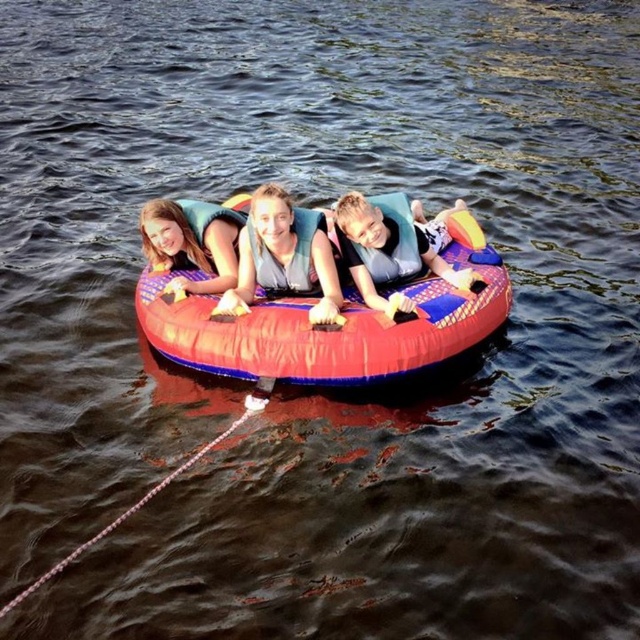
You are a safety inspector checking the inflatable tube setup. You see the rubberized red tube at center and the matte gray life vest at center. According to safety regulations, the life vest must be placed to the left of the tube. Is the current arrangement compliant?

The rubberized red tube at center is positioned on the right side of the matte gray life vest at center, meaning the life vest is to the left of the tube. This arrangement complies with the safety regulation requiring the life vest to be placed to the left of the tube.

You are a lifeguard and need to locate the matte gray life vest at center in the image. What are the coordinates where it can be found?

The matte gray life vest at center is located at coordinates point (284,257).

You are standing on the shore and want to throw a rope to the matte gray life vest at center floating in the water. If your throwing range is 6 meters, can you reach it?

The matte gray life vest at center is 6.68 meters away from the camera, which is beyond your 6 meters throwing range. Therefore, you cannot reach it.